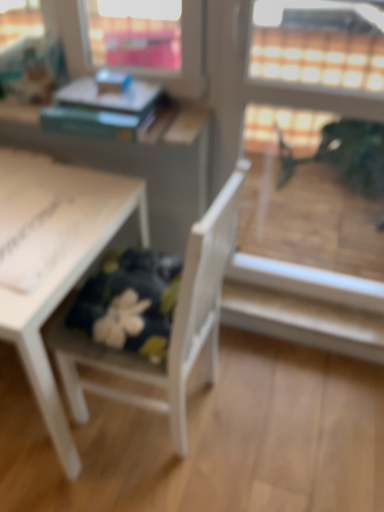
Question: From the image's perspective, is white wood chair at lower left over white matte table at lower left?

Choices:
 (A) yes
 (B) no

Answer: (B)

Question: Is white wood chair at lower left shorter than white matte table at lower left?

Choices:
 (A) yes
 (B) no

Answer: (B)

Question: Is white wood chair at lower left far from white matte table at lower left?

Choices:
 (A) yes
 (B) no

Answer: (B)

Question: From a real-world perspective, is white wood chair at lower left physically below white matte table at lower left?

Choices:
 (A) no
 (B) yes

Answer: (A)

Question: Is white wood chair at lower left closer to the viewer compared to white matte table at lower left?

Choices:
 (A) no
 (B) yes

Answer: (B)

Question: Can you confirm if white wood chair at lower left is thinner than white matte table at lower left?

Choices:
 (A) yes
 (B) no

Answer: (A)

Question: From a real-world perspective, is white matte table at lower left physically below white wood chair at lower left?

Choices:
 (A) yes
 (B) no

Answer: (A)

Question: Is white wood chair at lower left located within white matte table at lower left?

Choices:
 (A) no
 (B) yes

Answer: (A)

Question: Can you confirm if white matte table at lower left is smaller than white wood chair at lower left?

Choices:
 (A) yes
 (B) no

Answer: (B)

Question: Can you confirm if white matte table at lower left is thinner than white wood chair at lower left?

Choices:
 (A) yes
 (B) no

Answer: (B)

Question: Considering the relative sizes of white matte table at lower left and white wood chair at lower left in the image provided, is white matte table at lower left shorter than white wood chair at lower left?

Choices:
 (A) no
 (B) yes

Answer: (B)

Question: Is white matte table at lower left completely or partially outside of white wood chair at lower left?

Choices:
 (A) no
 (B) yes

Answer: (B)

Question: Is transparent glass screen door at upper right further to the viewer compared to white wood chair at lower left?

Choices:
 (A) yes
 (B) no

Answer: (A)